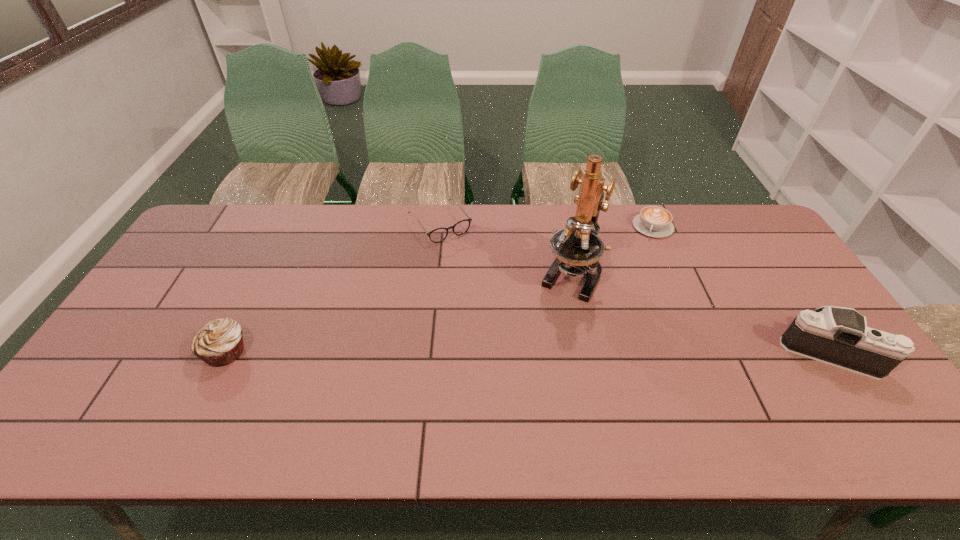
The height and width of the screenshot is (540, 960). I want to click on blank region between the muffin and the fourth object from left to right, so click(x=439, y=289).

Select which object appears as the fourth closest to the third nearest object. Please provide its 2D coordinates. Your answer should be formatted as a tuple, i.e. [(x, y)], where the tuple contains the x and y coordinates of a point satisfying the conditions above.

[(220, 342)]

Identify the location of object that stands as the second closest to the second object from right to left. (838, 336).

Identify the location of free space that satisfies the following two spatial constraints: 1. on the front side of the second object from right to left; 2. on the right side of the spectacles. (440, 226).

Where is `vacant area that satisfies the following two spatial constraints: 1. on the back side of the leftmost object; 2. on the left side of the third object from left to right`? vacant area that satisfies the following two spatial constraints: 1. on the back side of the leftmost object; 2. on the left side of the third object from left to right is located at coordinates (264, 273).

At what (x,y) coordinates should I click in order to perform the action: click on free space that satisfies the following two spatial constraints: 1. on the front side of the fourth object from right to left; 2. on the left side of the fourth object from left to right. Please return your answer as a coordinate pair (x, y). This screenshot has height=540, width=960. Looking at the image, I should click on (440, 226).